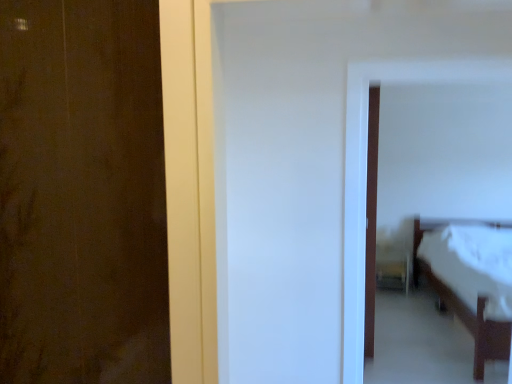
Measure the distance between white matte bed at lower right and camera.

The depth of white matte bed at lower right is 4.14 meters.

Find the location of a particular element. The width and height of the screenshot is (512, 384). white matte bed at lower right is located at coordinates (441, 227).

Describe the element at coordinates (441, 227) in the screenshot. The height and width of the screenshot is (384, 512). I see `white matte bed at lower right` at that location.

The width and height of the screenshot is (512, 384). I want to click on white matte bed at lower right, so click(x=441, y=227).